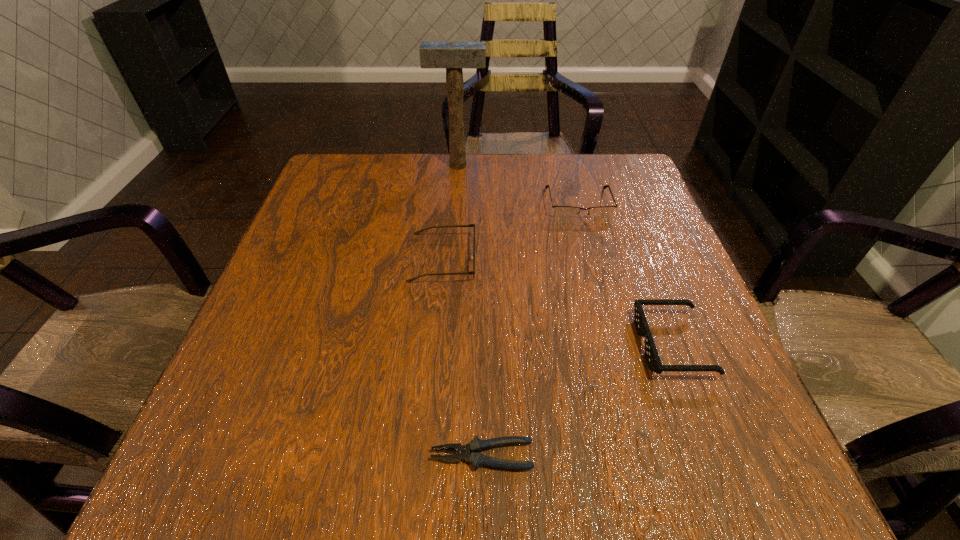
Locate an element on the screen. This screenshot has height=540, width=960. vacant space at the near right corner of the desktop is located at coordinates (758, 482).

Where is `vacant area that lies between the sunglasses and the third nearest object`? This screenshot has width=960, height=540. vacant area that lies between the sunglasses and the third nearest object is located at coordinates (558, 301).

Locate an element on the screen. free space between the second farthest object and the tallest object is located at coordinates [x=518, y=185].

Where is `empty location between the farthest object and the second nearest object`? This screenshot has height=540, width=960. empty location between the farthest object and the second nearest object is located at coordinates (565, 255).

At what (x,y) coordinates should I click in order to perform the action: click on free point between the right spectacles and the tallest object. Please return your answer as a coordinate pair (x, y). Image resolution: width=960 pixels, height=540 pixels. Looking at the image, I should click on (518, 185).

This screenshot has height=540, width=960. In order to click on vacant space that's between the fourth farthest object and the second farthest object in this screenshot , I will do `click(626, 274)`.

You are a GUI agent. You are given a task and a screenshot of the screen. Output one action in this format:
    pyautogui.click(x=<x>, y=<y>)
    Task: Click on the free point between the second nearest object and the nearest object
    The height and width of the screenshot is (540, 960).
    Given the screenshot: What is the action you would take?
    pyautogui.click(x=577, y=400)

Where is `free space that is in between the third farthest object and the fourth farthest object`? free space that is in between the third farthest object and the fourth farthest object is located at coordinates pos(558,301).

You are a GUI agent. You are given a task and a screenshot of the screen. Output one action in this format:
    pyautogui.click(x=<x>, y=<y>)
    Task: Click on the vacant area between the fourth nearest object and the pliers
    Image resolution: width=960 pixels, height=540 pixels.
    Given the screenshot: What is the action you would take?
    pyautogui.click(x=530, y=330)

Find the location of a particular element. vacant space in between the right spectacles and the left spectacles is located at coordinates (511, 231).